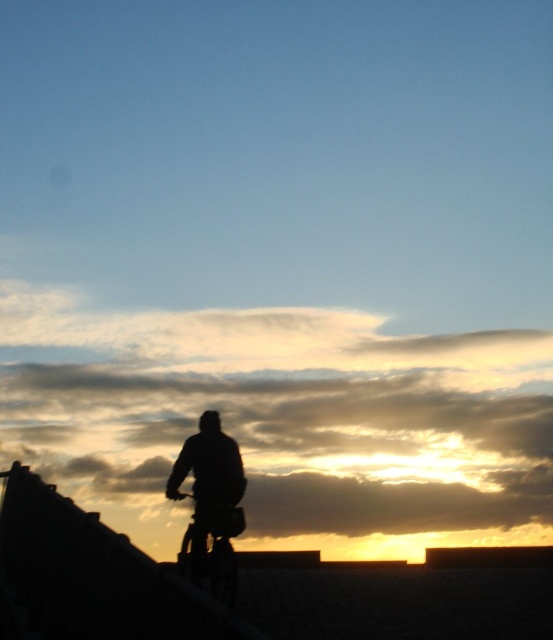
You are an astronomer analyzing the sunset scene. You notice the silhouette fabric at center. Based on its 2D location coordinates, can you determine if it is positioned closer to the top or bottom of the image?

The silhouette fabric at center is located at coordinates point (208, 477). Since the y coordinate is 0.378, which is closer to 0.5 than 0, it is positioned closer to the bottom of the image.

You are a photographer trying to capture the silhouette of the silhouette fabric at center and the metallic silver bicycle at center. Which object will appear in front in your photo?

The silhouette fabric at center is positioned over the metallic silver bicycle at center, so it will appear in front in the photo.